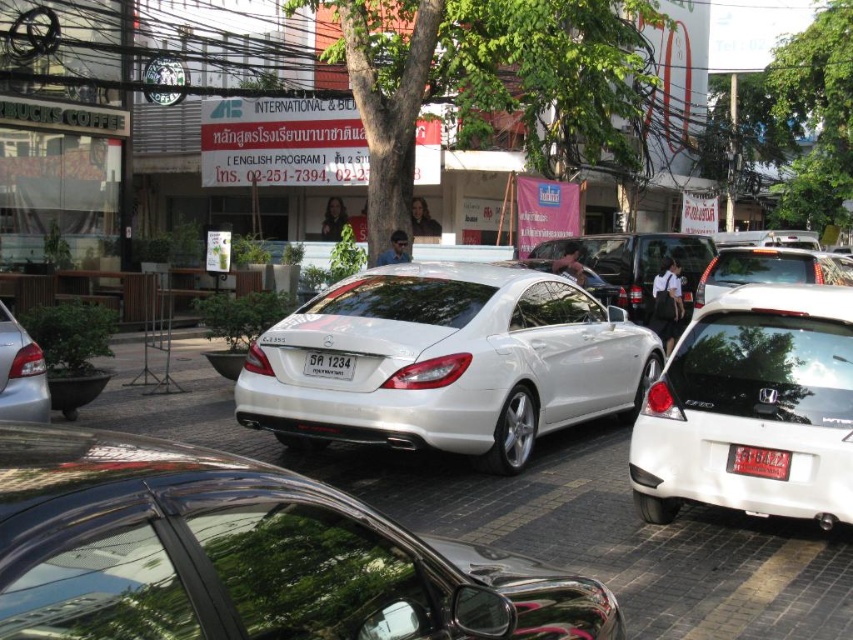
Question: Among these objects, which one is farthest from the camera?

Choices:
 (A) sleek silver sedan at center
 (B) metallic silver sedan at lower left

Answer: (A)

Question: Which of the following is the closest to the observer?

Choices:
 (A) (785, 474)
 (B) (339, 356)
 (C) (838, 404)

Answer: (C)

Question: Which object is positioned farthest from the white metallic sedan at center?

Choices:
 (A) white plastic license plate at center
 (B) sleek silver sedan at center

Answer: (A)

Question: Is glossy metallic car at center bigger than white glossy sedan at center-right?

Choices:
 (A) yes
 (B) no

Answer: (B)

Question: Can you confirm if glossy metallic car at center is positioned to the left of metallic silver sedan at lower left?

Choices:
 (A) yes
 (B) no

Answer: (B)

Question: Is white glossy sedan at center-right to the left of white plastic license plate at center from the viewer's perspective?

Choices:
 (A) yes
 (B) no

Answer: (B)